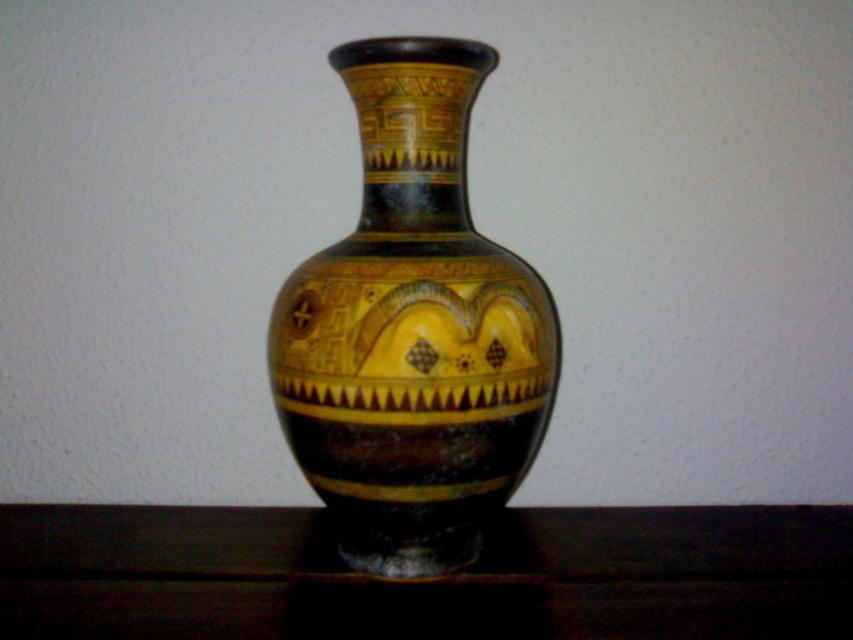
You are standing in front of the decorative vase and want to place a small ornament on the glossy wood table at lower center. Since the matte black vase at center is in the way, can you move around it to access the table? Explain your reasoning.

The matte black vase at center is further to the viewer than the glossy wood table at lower center. This means the vase is closer to you, blocking your direct path to the table. However, you can move around it to access the table since the vase is an object that can be circumvented.

Consider the image. You are arranging flowers in the matte black vase at center and need to place it on the glossy wood table at lower center. Which side of the table should you place the vase on to ensure it aligns with its current position relative to the table?

The matte black vase at center is to the left of the glossy wood table at lower center, so you should place it on the left side of the table to maintain alignment.